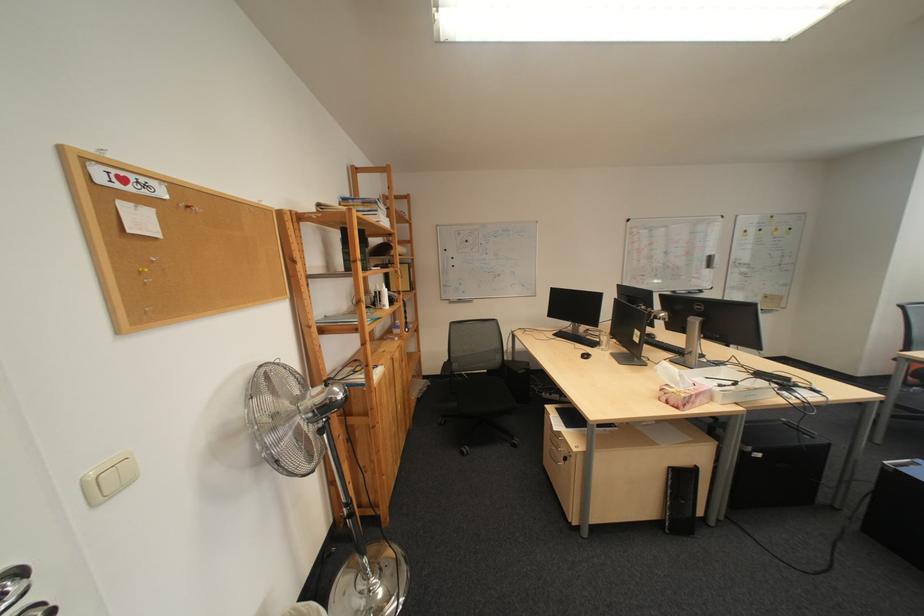
In order to click on black computer mouse in this screenshot , I will do `click(586, 355)`.